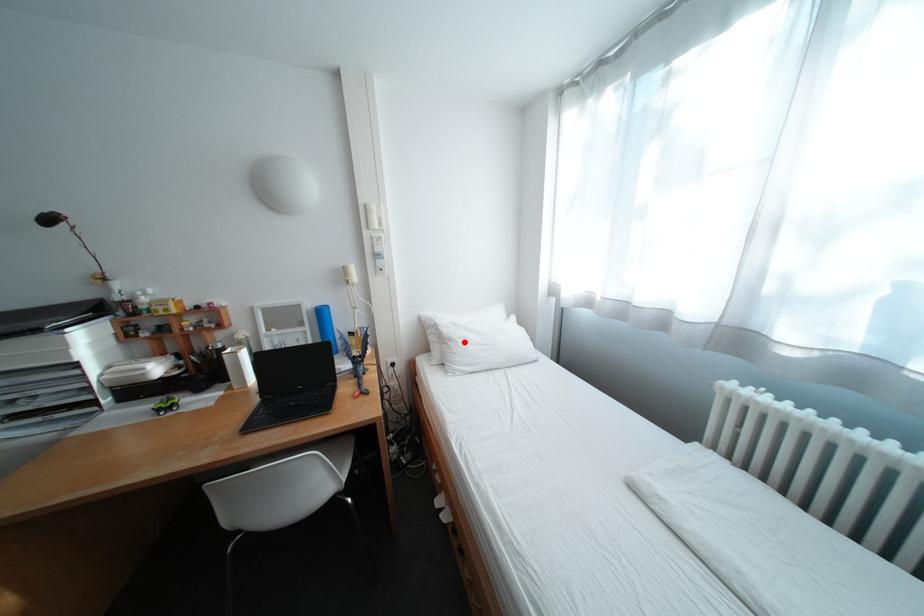
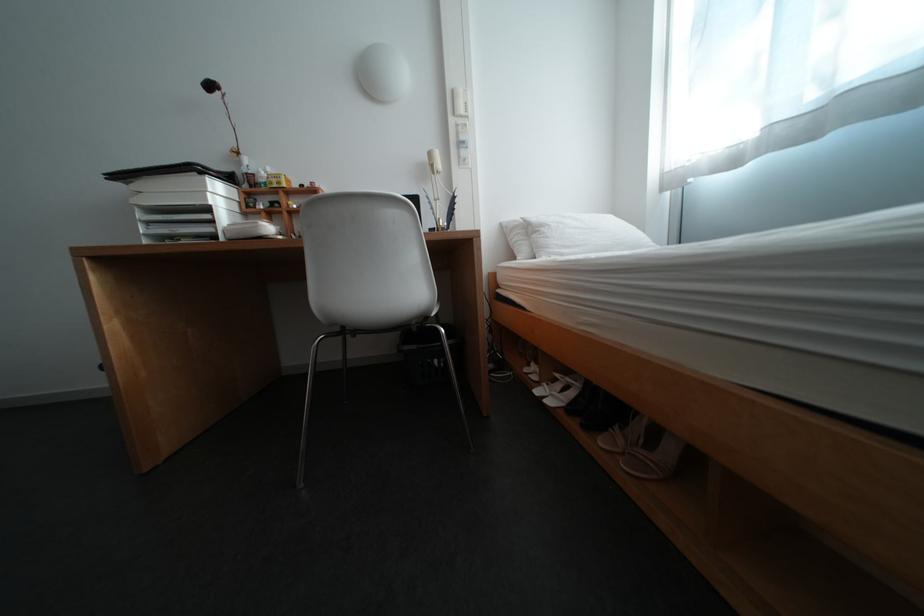
Question: I am providing you with two images of the same scene from different viewpoints. A red point is shown in image1. For the corresponding object point in image2, is it positioned nearer or farther from the camera?

Choices:
 (A) Nearer
 (B) Farther

Answer: (A)